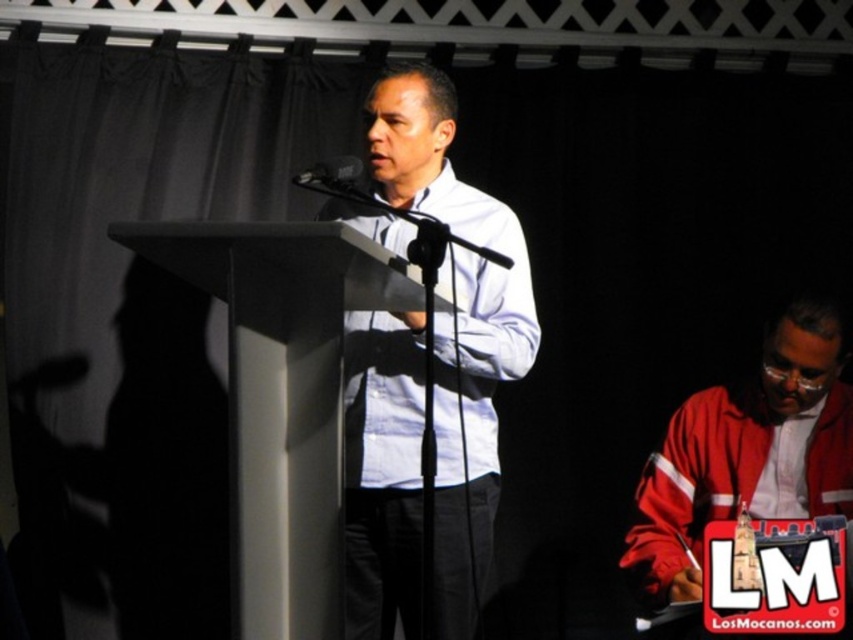
Question: Can you confirm if white smooth podium at center is bigger than black matte microphone at center?

Choices:
 (A) no
 (B) yes

Answer: (B)

Question: Which of the following is the farthest from the observer?

Choices:
 (A) white smooth podium at center
 (B) red matte jacket at lower right
 (C) black matte microphone at center

Answer: (B)

Question: Based on their relative distances, which object is nearer to the red matte jacket at lower right?

Choices:
 (A) white matte shirt at center
 (B) white smooth podium at center
 (C) black matte microphone at center

Answer: (A)

Question: Can you confirm if white matte shirt at center is positioned to the left of red matte jacket at lower right?

Choices:
 (A) yes
 (B) no

Answer: (A)

Question: Is red matte jacket at lower right bigger than black matte microphone at center?

Choices:
 (A) no
 (B) yes

Answer: (B)

Question: Estimate the real-world distances between objects in this image. Which object is farther from the white smooth podium at center?

Choices:
 (A) white matte shirt at center
 (B) black matte microphone at center
 (C) red matte jacket at lower right

Answer: (C)